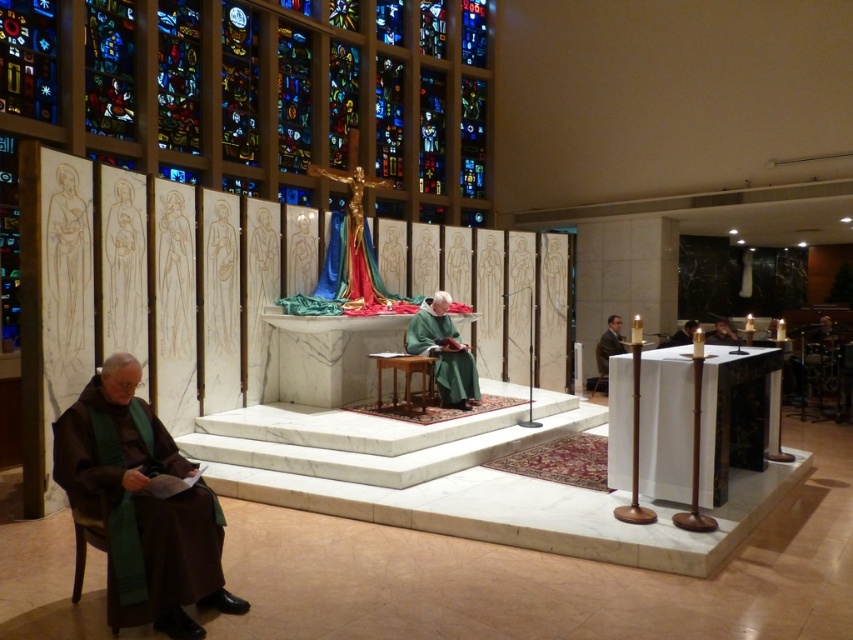
From the picture: You are standing in the church and want to take a photo of both point (422,321) and point (602,346). Which point will appear larger in your photo?

Point (422,321) is closer to the camera than point (602,346), so it will appear larger in the photo.

You are standing in the church and want to walk towards the altar. There are two points marked in the image, point (97, 406) and point (706, 339). Which point is closer to you as you face the altar?

Point (97, 406) is in front of point (706, 339), so it is closer to you as you face the altar.

You are standing in the church and want to approach the brown woolen robe at lower left and the matte black face at right. Which object will you encounter first as you move forward?

The brown woolen robe at lower left is closer to the viewer than the matte black face at right, so you will encounter the brown woolen robe at lower left first.